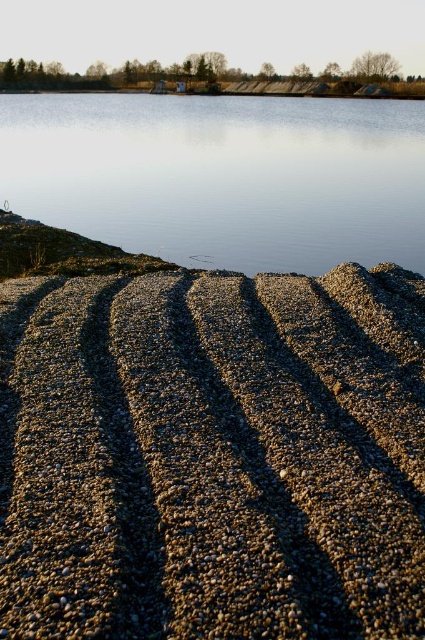
Does brown pebbled gravel at lower center appear on the right side of clear water at center?

Incorrect, brown pebbled gravel at lower center is not on the right side of clear water at center.

Is brown pebbled gravel at lower center thinner than clear water at center?

Indeed, brown pebbled gravel at lower center has a lesser width compared to clear water at center.

I want to click on brown pebbled gravel at lower center, so click(x=212, y=456).